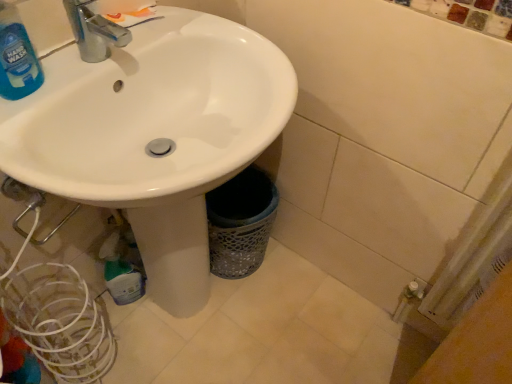
Question: From the image's perspective, would you say blue translucent liquid at upper left is positioned over white glossy sink at center?

Choices:
 (A) yes
 (B) no

Answer: (A)

Question: From a real-world perspective, is blue translucent liquid at upper left beneath white glossy sink at center?

Choices:
 (A) yes
 (B) no

Answer: (B)

Question: Is blue translucent liquid at upper left looking in the opposite direction of white glossy sink at center?

Choices:
 (A) yes
 (B) no

Answer: (A)

Question: Is blue translucent liquid at upper left far from white glossy sink at center?

Choices:
 (A) no
 (B) yes

Answer: (A)

Question: Can you confirm if blue translucent liquid at upper left is smaller than white glossy sink at center?

Choices:
 (A) yes
 (B) no

Answer: (A)

Question: Does blue translucent liquid at upper left lie in front of white glossy sink at center?

Choices:
 (A) no
 (B) yes

Answer: (A)

Question: Does white glossy sink at center lie behind blue translucent liquid at upper left?

Choices:
 (A) yes
 (B) no

Answer: (B)

Question: Is white glossy sink at center far away from blue translucent liquid at upper left?

Choices:
 (A) yes
 (B) no

Answer: (B)

Question: Does white glossy sink at center appear on the left side of blue translucent liquid at upper left?

Choices:
 (A) yes
 (B) no

Answer: (B)

Question: Considering the relative sizes of white glossy sink at center and blue translucent liquid at upper left in the image provided, is white glossy sink at center wider than blue translucent liquid at upper left?

Choices:
 (A) no
 (B) yes

Answer: (B)

Question: Can you confirm if white glossy sink at center is bigger than blue translucent liquid at upper left?

Choices:
 (A) yes
 (B) no

Answer: (A)

Question: From a real-world perspective, is white glossy sink at center physically above blue translucent liquid at upper left?

Choices:
 (A) no
 (B) yes

Answer: (A)

Question: From their relative heights in the image, would you say blue translucent liquid at upper left is taller or shorter than white glossy sink at center?

Choices:
 (A) short
 (B) tall

Answer: (A)